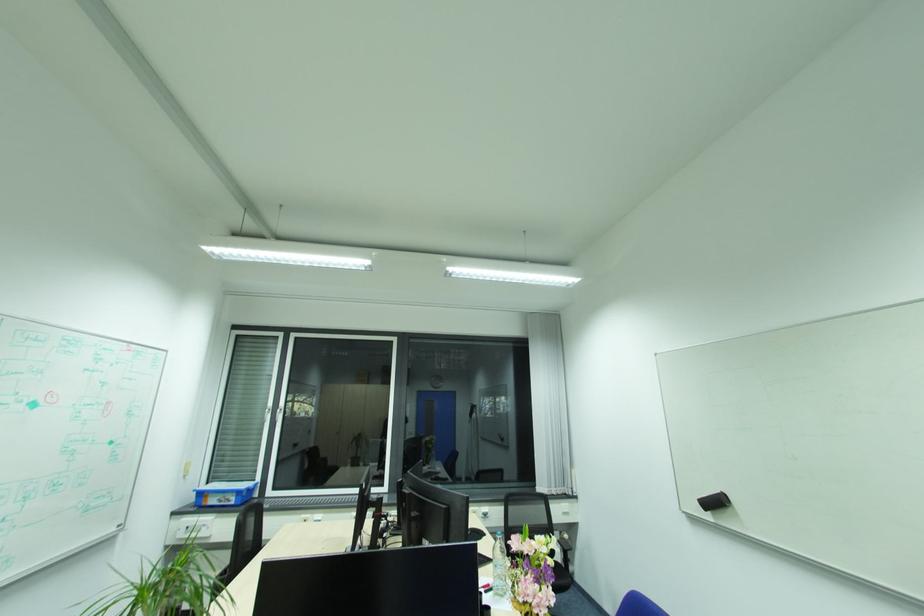
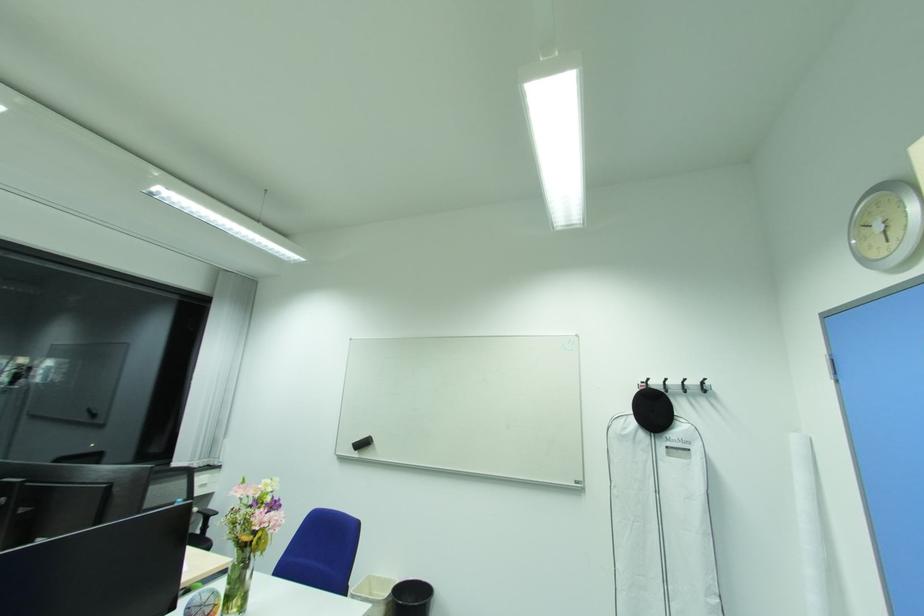
Question: The camera is either moving clockwise (left) or counter-clockwise (right) around the object. The first image is from the beginning of the video and the second image is from the end. Is the camera moving left or right when shooting the video?

Choices:
 (A) Left
 (B) Right

Answer: (A)